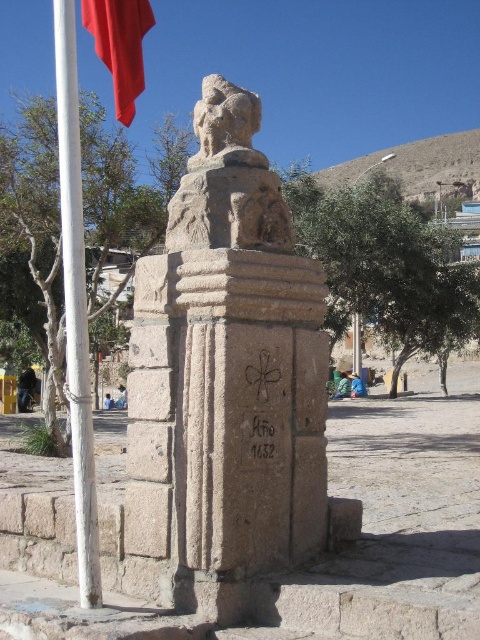
Is carved stone lion at center bigger than white metallic pole at left?

Actually, carved stone lion at center might be smaller than white metallic pole at left.

This screenshot has width=480, height=640. I want to click on carved stone lion at center, so click(228, 179).

Can you confirm if white metallic pole at left is positioned to the right of black stone writing at center?

Incorrect, white metallic pole at left is not on the right side of black stone writing at center.

Which is in front, point (60, 148) or point (262, 442)?

Point (60, 148) is more forward.

Which is in front, point (78, 160) or point (259, 451)?

Positioned in front is point (78, 160).

I want to click on white metallic pole at left, so click(x=75, y=305).

Which of these two, carved stone lion at center or black stone writing at center, stands taller?

Standing taller between the two is carved stone lion at center.

Is carved stone lion at center smaller than black stone writing at center?

Incorrect, carved stone lion at center is not smaller in size than black stone writing at center.

This screenshot has width=480, height=640. What do you see at coordinates (228, 179) in the screenshot?
I see `carved stone lion at center` at bounding box center [228, 179].

What are the coordinates of `carved stone lion at center` in the screenshot? It's located at (228, 179).